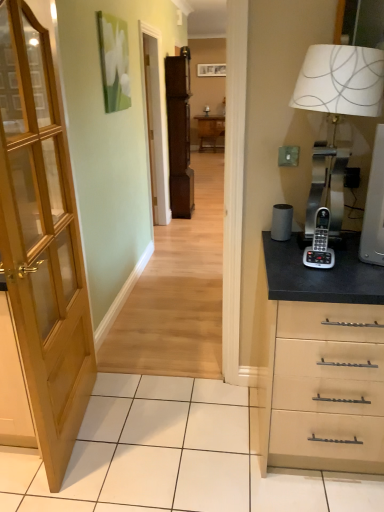
The image size is (384, 512). Find the location of `vacant area that lies in front of brown wood file cabinet at center`. vacant area that lies in front of brown wood file cabinet at center is located at coordinates (200, 217).